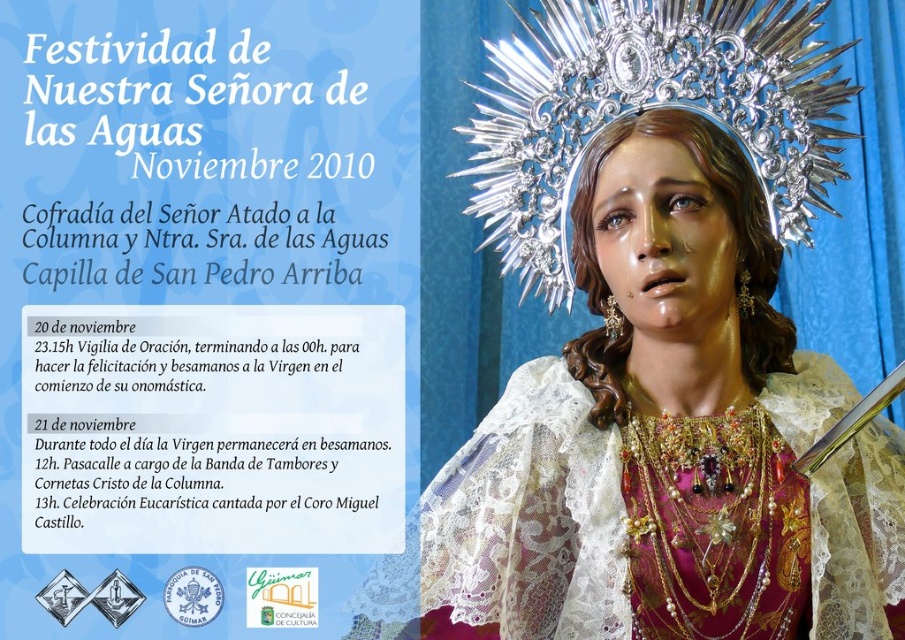
Question: Is white paper at upper left above silver metallic crown at upper center?

Choices:
 (A) yes
 (B) no

Answer: (B)

Question: Is white paper at upper left bigger than silver metallic crown at upper center?

Choices:
 (A) no
 (B) yes

Answer: (B)

Question: Does white paper at upper left have a larger size compared to silver metallic crown at upper center?

Choices:
 (A) yes
 (B) no

Answer: (A)

Question: Which point is closer to the camera taking this photo?

Choices:
 (A) (867, 486)
 (B) (331, 45)

Answer: (A)

Question: Which is nearer to the white paper at upper left?

Choices:
 (A) lace fabric at center
 (B) silver metallic crown at upper center

Answer: (B)

Question: Among these points, which one is nearest to the camera?

Choices:
 (A) (837, 90)
 (B) (335, 44)

Answer: (A)